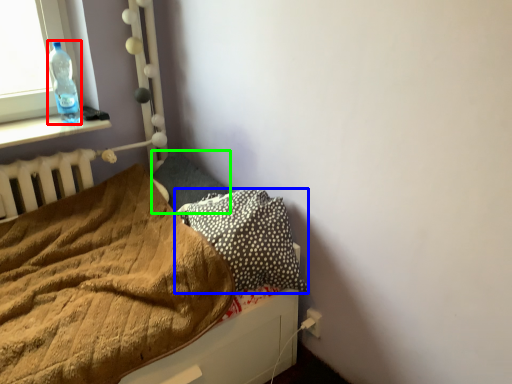
Question: Considering the real-world distances, which object is closest to bottle (highlighted by a red box)? pillow (highlighted by a blue box) or pillow (highlighted by a green box).

Choices:
 (A) pillow
 (B) pillow

Answer: (B)